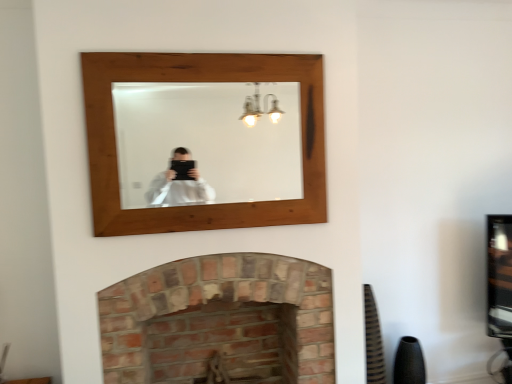
Question: Is wooden mirror at upper center to the left or to the right of brick fireplace at lower center in the image?

Choices:
 (A) left
 (B) right

Answer: (A)

Question: Based on their sizes in the image, would you say wooden mirror at upper center is bigger or smaller than brick fireplace at lower center?

Choices:
 (A) big
 (B) small

Answer: (B)

Question: Considering the positions of wooden mirror at upper center and brick fireplace at lower center in the image, is wooden mirror at upper center wider or thinner than brick fireplace at lower center?

Choices:
 (A) thin
 (B) wide

Answer: (A)

Question: From the image's perspective, relative to wooden mirror at upper center, is brick fireplace at lower center above or below?

Choices:
 (A) above
 (B) below

Answer: (B)

Question: Considering the positions of brick fireplace at lower center and wooden mirror at upper center in the image, is brick fireplace at lower center taller or shorter than wooden mirror at upper center?

Choices:
 (A) short
 (B) tall

Answer: (B)

Question: From a real-world perspective, is brick fireplace at lower center above or below wooden mirror at upper center?

Choices:
 (A) below
 (B) above

Answer: (A)

Question: Considering the positions of brick fireplace at lower center and wooden mirror at upper center in the image, is brick fireplace at lower center wider or thinner than wooden mirror at upper center?

Choices:
 (A) wide
 (B) thin

Answer: (A)